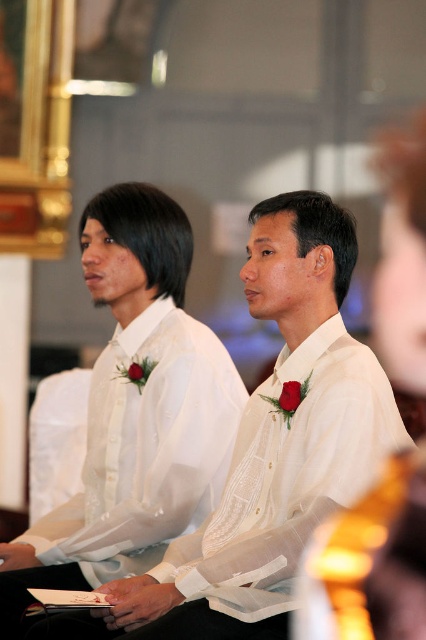
Which of these two, white embroidered shirt at center or white sheer shirt at center, stands shorter?

white embroidered shirt at center is shorter.

Which is more to the right, white embroidered shirt at center or white sheer shirt at center?

Positioned to the right is white embroidered shirt at center.

Looking at this image, who is more forward, [302,300] or [187,461]?

Point [302,300] is more forward.

The image size is (426, 640). In order to click on white embroidered shirt at center in this screenshot , I will do `click(276, 442)`.